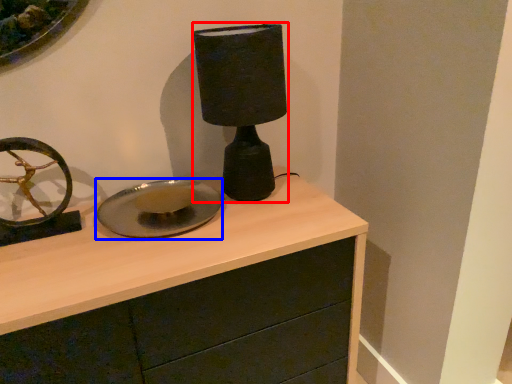
Question: Which point is further to the camera, table lamp (highlighted by a red box) or plate (highlighted by a blue box)?

Choices:
 (A) table lamp
 (B) plate

Answer: (B)